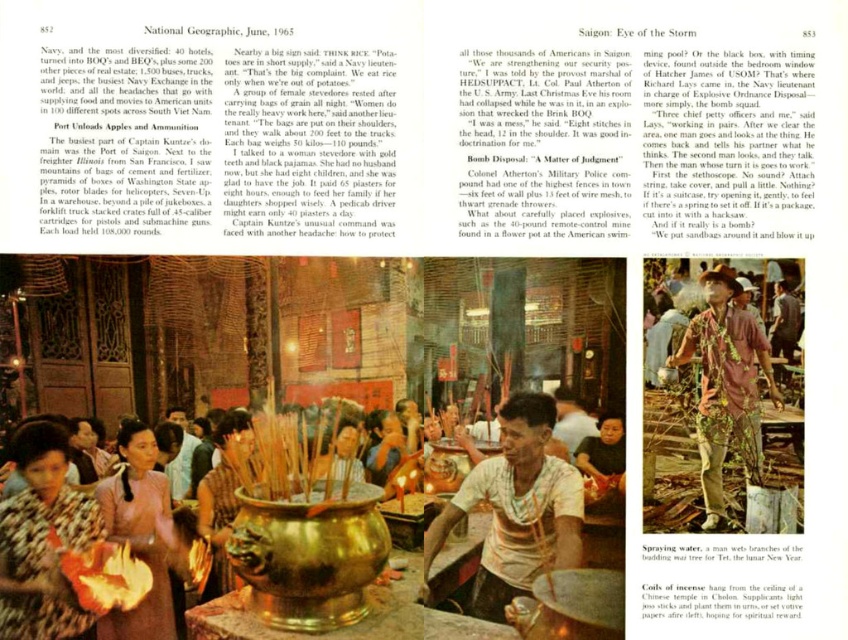
You are a photographer standing in front of the magazine page. You notice the white cotton shirt at center and the fluffy leopard print dress at center. Which item is closer to you?

The white cotton shirt at center is closer to you because it is further to the viewer than the fluffy leopard print dress at center.

You are a fashion designer observing the National Geographic article from June 1965. You notice the white cotton shirt at center and the fluffy leopard print dress at center. Which clothing item takes up more horizontal space in the image?

The white cotton shirt at center might be wider than fluffy leopard print dress at center, so it likely occupies more horizontal space.